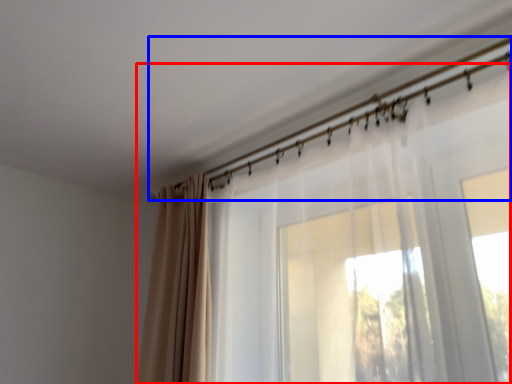
Question: Which object is closer to the camera taking this photo, curtain (highlighted by a red box) or clothesline (highlighted by a blue box)?

Choices:
 (A) curtain
 (B) clothesline

Answer: (A)